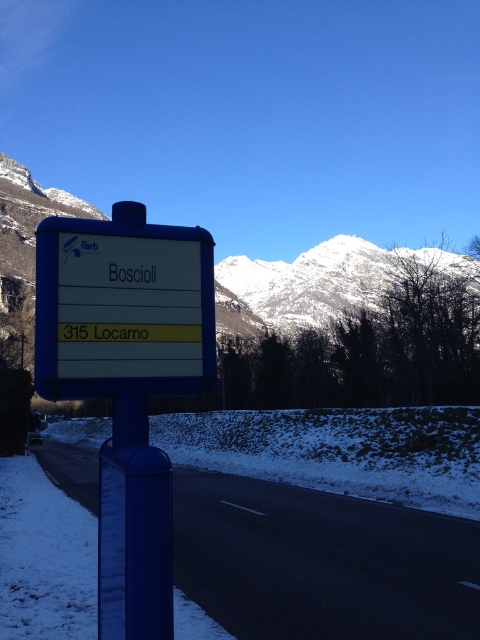
Question: Can you confirm if blue metallic sign at center is positioned above blue plastic sign at center?

Choices:
 (A) yes
 (B) no

Answer: (B)

Question: Which point is farther to the camera?

Choices:
 (A) white snow-covered mountain at upper center
 (B) blue metallic sign at center

Answer: (A)

Question: Is blue metallic sign at center to the right of blue plastic sign at center from the viewer's perspective?

Choices:
 (A) no
 (B) yes

Answer: (B)

Question: Which is nearer to the white snow-covered mountain at upper center?

Choices:
 (A) blue plastic sign at center
 (B) blue metallic sign at center

Answer: (B)

Question: Is blue metallic sign at center above white snow-covered mountain at upper center?

Choices:
 (A) no
 (B) yes

Answer: (A)

Question: Based on their relative distances, which object is farther from the blue metallic sign at center?

Choices:
 (A) blue plastic sign at center
 (B) white snow-covered mountain at upper center

Answer: (B)